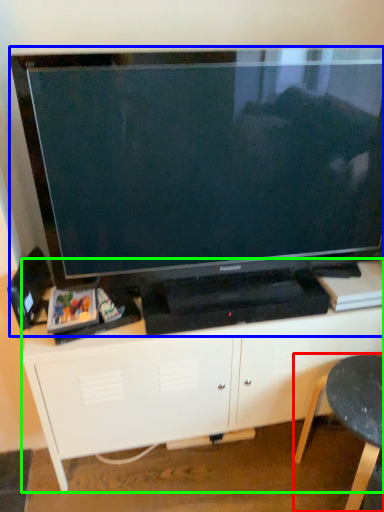
Question: Estimate the real-world distances between objects in this image. Which object is farther from furniture (highlighted by a red box), television (highlighted by a blue box) or entertainment center (highlighted by a green box)?

Choices:
 (A) television
 (B) entertainment center

Answer: (A)